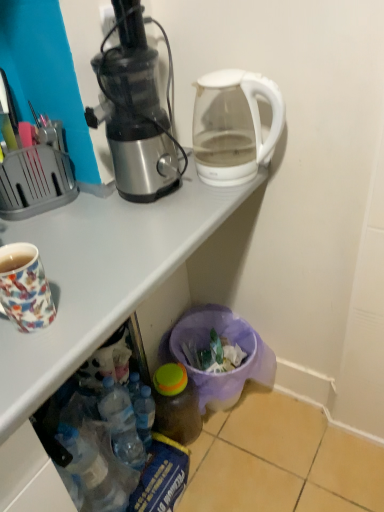
I want to click on free space in front of translucent plastic bottle at lower center, the second bottle in the right-to-left sequence, so click(x=145, y=472).